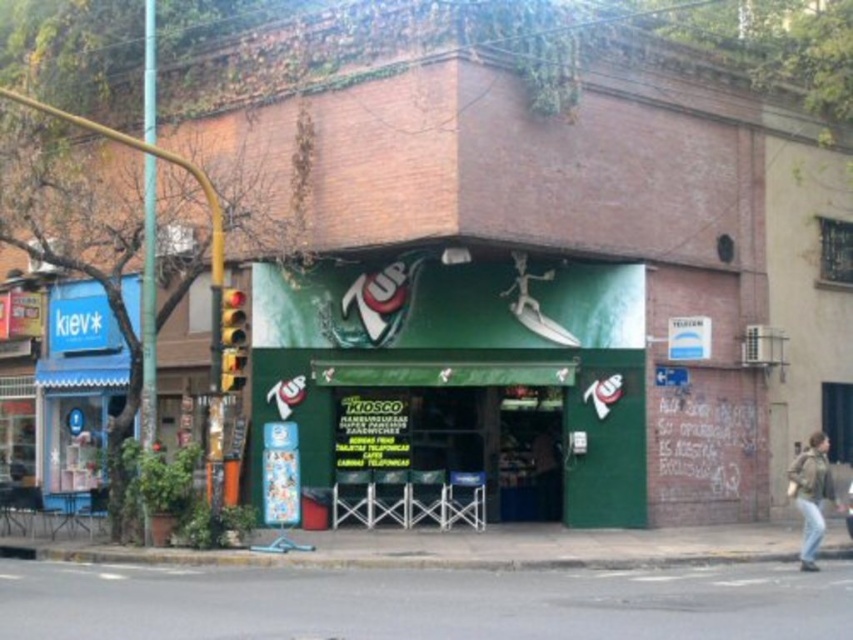
Question: Can you confirm if green matte signboard at center is positioned above light brown leather jacket at lower right?

Choices:
 (A) yes
 (B) no

Answer: (A)

Question: Does green matte signboard at center appear on the left side of green leather jacket at lower right?

Choices:
 (A) yes
 (B) no

Answer: (A)

Question: Which of the following is the closest to the observer?

Choices:
 (A) green leather jacket at lower right
 (B) light brown leather jacket at lower right
 (C) green matte signboard at center

Answer: (A)

Question: Which of the following is the closest to the observer?

Choices:
 (A) (846, 499)
 (B) (817, 458)
 (C) (270, 406)

Answer: (B)

Question: Is green leather jacket at lower right to the left of light brown leather jacket at lower right from the viewer's perspective?

Choices:
 (A) yes
 (B) no

Answer: (A)

Question: Which object is positioned closest to the green matte signboard at center?

Choices:
 (A) light brown leather jacket at lower right
 (B) green leather jacket at lower right

Answer: (B)